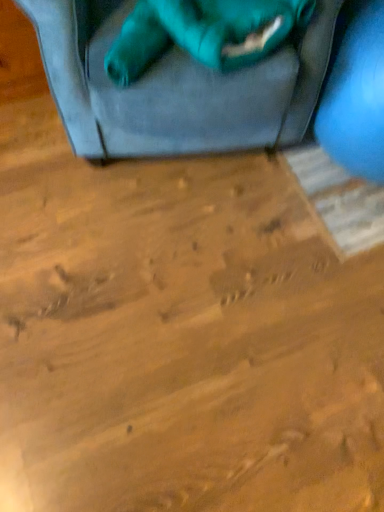
Image resolution: width=384 pixels, height=512 pixels. Identify the location of matte blue exercise ball at right. (355, 92).

The image size is (384, 512). Describe the element at coordinates (355, 92) in the screenshot. I see `matte blue exercise ball at right` at that location.

What do you see at coordinates (203, 33) in the screenshot? I see `teal fabric cat at upper center` at bounding box center [203, 33].

You are a GUI agent. You are given a task and a screenshot of the screen. Output one action in this format:
    pyautogui.click(x=<x>, y=<y>)
    Task: Click on the teal fabric cat at upper center
    This screenshot has height=512, width=384.
    Given the screenshot: What is the action you would take?
    pyautogui.click(x=203, y=33)

I want to click on matte blue exercise ball at right, so click(x=355, y=92).

Considering the positions of objects teal fabric cat at upper center and matte blue exercise ball at right in the image provided, who is more to the right, teal fabric cat at upper center or matte blue exercise ball at right?

From the viewer's perspective, matte blue exercise ball at right appears more on the right side.

Does teal fabric cat at upper center come behind matte blue exercise ball at right?

That is True.

Considering the positions of point (145, 10) and point (353, 25), is point (145, 10) closer or farther from the camera than point (353, 25)?

Point (145, 10) appears to be closer to the viewer than point (353, 25).

From the picture: From the image's perspective, does teal fabric cat at upper center appear higher than matte blue exercise ball at right?

Yes.

From a real-world perspective, is teal fabric cat at upper center located higher than matte blue exercise ball at right?

Yes.

Can you confirm if teal fabric cat at upper center is wider than matte blue exercise ball at right?

No, teal fabric cat at upper center is not wider than matte blue exercise ball at right.

In terms of height, does teal fabric cat at upper center look taller or shorter compared to matte blue exercise ball at right?

Clearly, teal fabric cat at upper center is shorter compared to matte blue exercise ball at right.

Between teal fabric cat at upper center and matte blue exercise ball at right, which one has larger size?

With larger size is matte blue exercise ball at right.

Is teal fabric cat at upper center positioned beyond the bounds of matte blue exercise ball at right?

Absolutely, teal fabric cat at upper center is external to matte blue exercise ball at right.

Is teal fabric cat at upper center directly adjacent to matte blue exercise ball at right?

No, teal fabric cat at upper center is not touching matte blue exercise ball at right.

Is matte blue exercise ball at right at the back of teal fabric cat at upper center?

No, teal fabric cat at upper center is not facing away from matte blue exercise ball at right.

How different are the orientations of teal fabric cat at upper center and matte blue exercise ball at right in degrees?

The angular difference between teal fabric cat at upper center and matte blue exercise ball at right is 0.899 degrees.

Measure the distance between teal fabric cat at upper center and matte blue exercise ball at right.

They are 11.82 inches apart.

This screenshot has width=384, height=512. Identify the location of turquoise in front of the teal fabric cat at upper center. (355, 92).

From the picture: Does matte blue exercise ball at right appear on the right side of teal fabric cat at upper center?

Yes.

Is the position of matte blue exercise ball at right less distant than that of teal fabric cat at upper center?

That is True.

Which is nearer, (x=368, y=167) or (x=225, y=13)?

Positioned in front is point (x=225, y=13).

From the image's perspective, would you say matte blue exercise ball at right is positioned over teal fabric cat at upper center?

Incorrect, from the image's perspective, matte blue exercise ball at right is lower than teal fabric cat at upper center.

From a real-world perspective, between matte blue exercise ball at right and teal fabric cat at upper center, who is vertically higher?

In real-world perspective, teal fabric cat at upper center is above.

Which object is wider, matte blue exercise ball at right or teal fabric cat at upper center?

Wider between the two is matte blue exercise ball at right.

Between matte blue exercise ball at right and teal fabric cat at upper center, which one has less height?

With less height is teal fabric cat at upper center.

Who is bigger, matte blue exercise ball at right or teal fabric cat at upper center?

With larger size is matte blue exercise ball at right.

Is matte blue exercise ball at right located outside teal fabric cat at upper center?

Yes, matte blue exercise ball at right is not within teal fabric cat at upper center.

Is the surface of matte blue exercise ball at right in direct contact with teal fabric cat at upper center?

No.

Is matte blue exercise ball at right oriented towards teal fabric cat at upper center?

No, matte blue exercise ball at right is not turned towards teal fabric cat at upper center.

There is a matte blue exercise ball at right. Identify the location of animal above it (from a real-world perspective). (203, 33).

Find the location of `turquoise in front of the teal fabric cat at upper center`. turquoise in front of the teal fabric cat at upper center is located at coordinates (355, 92).

Where is `turquoise below the teal fabric cat at upper center (from a real-world perspective)`? Image resolution: width=384 pixels, height=512 pixels. turquoise below the teal fabric cat at upper center (from a real-world perspective) is located at coordinates (355, 92).